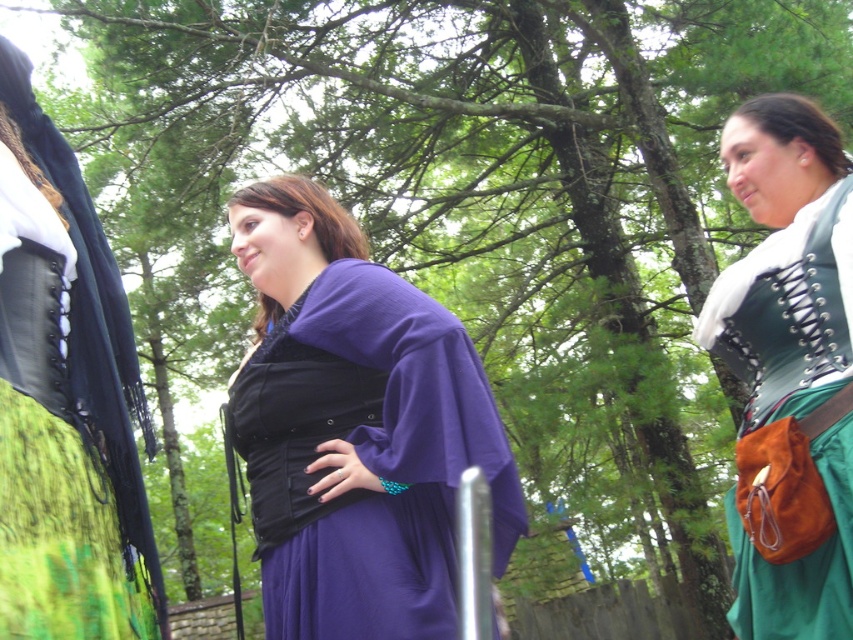
Can you confirm if purple matte dress at center is shorter than matte green fabric at right?

Yes.

Between purple matte dress at center and matte green fabric at right, which one has less height?

Standing shorter between the two is purple matte dress at center.

Identify the location of purple matte dress at center. The height and width of the screenshot is (640, 853). (309, 212).

Where is `purple matte dress at center`? Image resolution: width=853 pixels, height=640 pixels. purple matte dress at center is located at coordinates (309, 212).

Looking at this image, does purple velvet dress at center appear under purple matte dress at center?

Yes.

Can you confirm if purple velvet dress at center is shorter than purple matte dress at center?

In fact, purple velvet dress at center may be taller than purple matte dress at center.

Image resolution: width=853 pixels, height=640 pixels. What do you see at coordinates (65, 400) in the screenshot?
I see `purple velvet dress at center` at bounding box center [65, 400].

Where is `purple velvet dress at center`? This screenshot has width=853, height=640. purple velvet dress at center is located at coordinates (65, 400).

Who is positioned more to the right, purple velvet dress at center or green suede skirt at center?

green suede skirt at center

Does point (152, 541) come behind point (820, 516)?

Yes.

You are a GUI agent. You are given a task and a screenshot of the screen. Output one action in this format:
    pyautogui.click(x=<x>, y=<y>)
    Task: Click on the purple velvet dress at center
    
    Given the screenshot: What is the action you would take?
    pyautogui.click(x=65, y=400)